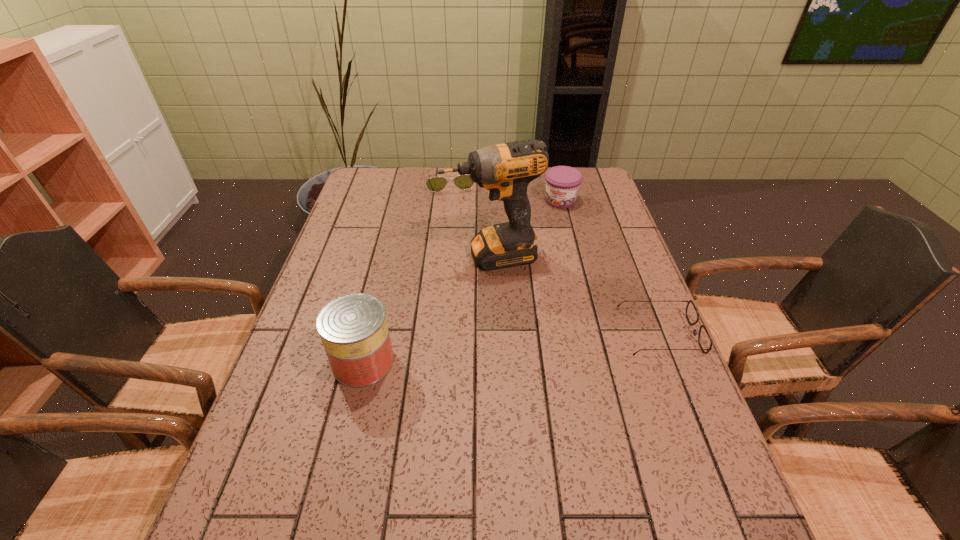
The width and height of the screenshot is (960, 540). What are the coordinates of `free space that satisfies the following two spatial constraints: 1. on the front side of the left sunglasses; 2. on the front-facing side of the nearer sunglasses` in the screenshot? It's located at (433, 334).

Where is `vacant position in the image that satisfies the following two spatial constraints: 1. on the back side of the fourth object from left to right; 2. on the left side of the can`? This screenshot has height=540, width=960. vacant position in the image that satisfies the following two spatial constraints: 1. on the back side of the fourth object from left to right; 2. on the left side of the can is located at coordinates (402, 200).

Locate an element on the screen. vacant area in the image that satisfies the following two spatial constraints: 1. on the back side of the right sunglasses; 2. on the front-facing side of the fourth shortest object is located at coordinates (370, 334).